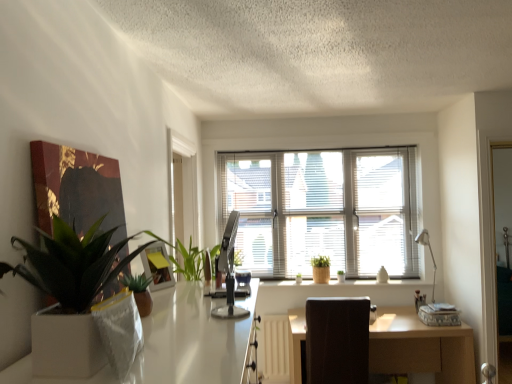
The image size is (512, 384). I want to click on free area below green woven basket at center, which is the first houseplant in back-to-front order (from a real-world perspective), so click(321, 277).